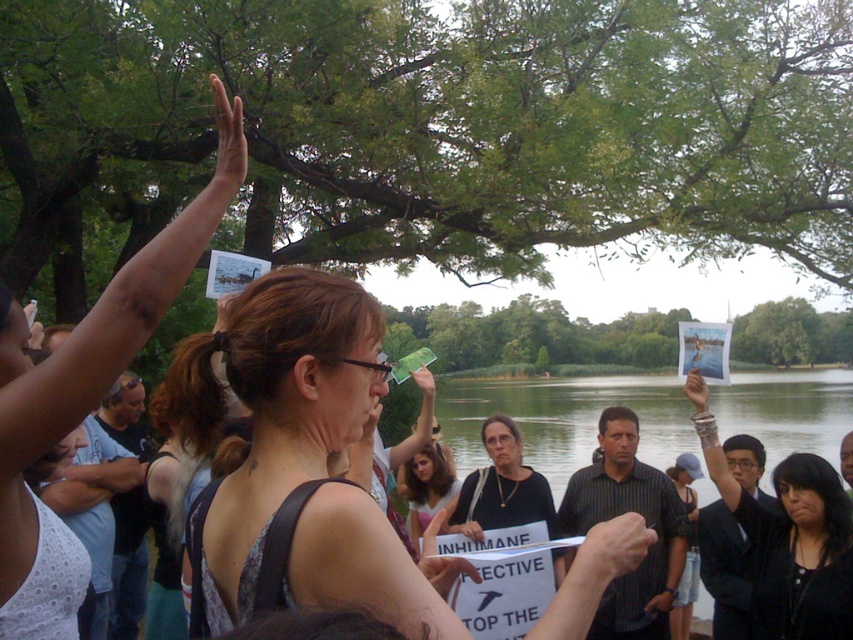
You are a photographer trying to capture a clear shot of the brown hair at center without the green leafy tree at upper center blocking it. What adjustment should you make to your camera position?

Move your camera position downward to avoid the green leafy tree at upper center blocking the view of the brown hair at center, since the tree is wider than the hair.

Based on the photo, you are standing at the position marked by the point at coordinates (x=432, y=129) in the image. Which object are you directly facing?

The point at coordinates (x=432, y=129) is on the green leafy tree at upper center, so you are directly facing the green leafy tree at upper center.

You are standing in the crowd and want to find the person wearing the matte black tank top at upper left. Which direction should you look relative to the denim shorts at lower right?

To locate the matte black tank top at upper left, look above the denim shorts at lower right since the matte black tank top at upper left is positioned above it.